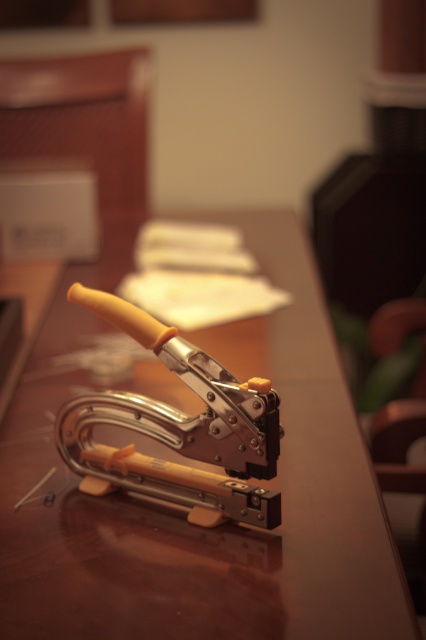
Question: Among these objects, which one is nearest to the camera?

Choices:
 (A) metallic silver stapler at center
 (B) brown wooden table at center

Answer: (B)

Question: Can you confirm if brown wooden table at center is thinner than metallic silver stapler at center?

Choices:
 (A) no
 (B) yes

Answer: (A)

Question: Does brown wooden table at center appear under metallic silver stapler at center?

Choices:
 (A) no
 (B) yes

Answer: (A)

Question: Among these objects, which one is farthest from the camera?

Choices:
 (A) brown wooden table at center
 (B) metallic silver stapler at center

Answer: (B)

Question: Which of the following is the closest to the observer?

Choices:
 (A) (135, 317)
 (B) (222, 353)

Answer: (A)

Question: Is brown wooden table at center to the left of metallic silver stapler at center from the viewer's perspective?

Choices:
 (A) no
 (B) yes

Answer: (A)